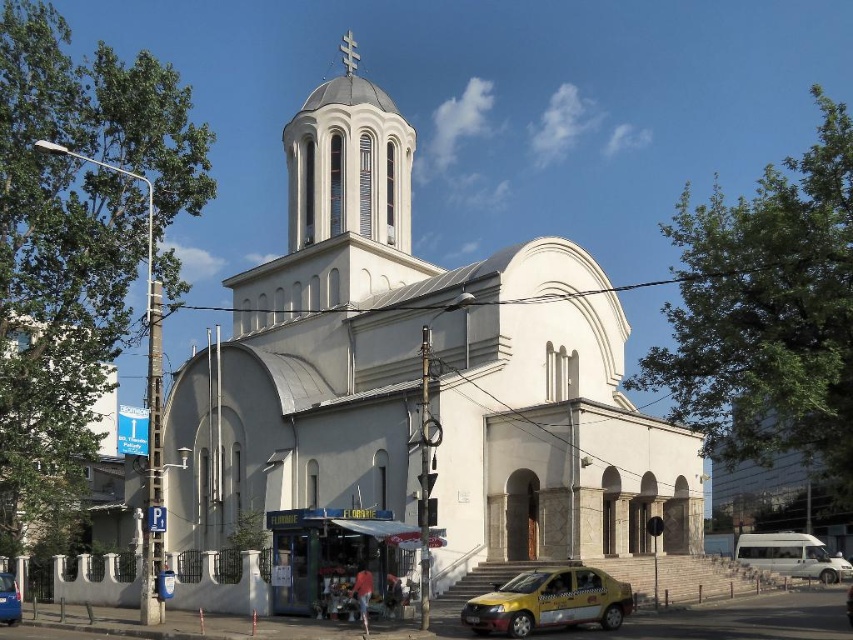
Question: Does white smooth church at center have a larger size compared to white smooth dome at upper center?

Choices:
 (A) no
 (B) yes

Answer: (B)

Question: From the image, what is the correct spatial relationship of white smooth dome at upper center in relation to blue metallic car at lower left?

Choices:
 (A) below
 (B) above

Answer: (B)

Question: Which point appears farthest from the camera in this image?

Choices:
 (A) (320, 477)
 (B) (386, 172)

Answer: (B)

Question: Considering the real-world distances, which object is closest to the blue metallic car at lower left?

Choices:
 (A) yellow matte taxi at lower center
 (B) white smooth dome at upper center
 (C) white matte van at lower right

Answer: (A)

Question: Based on their relative distances, which object is nearer to the blue metallic car at lower left?

Choices:
 (A) white smooth dome at upper center
 (B) white smooth church at center

Answer: (B)

Question: Does yellow matte taxi at lower center come behind blue metallic car at lower left?

Choices:
 (A) no
 (B) yes

Answer: (A)